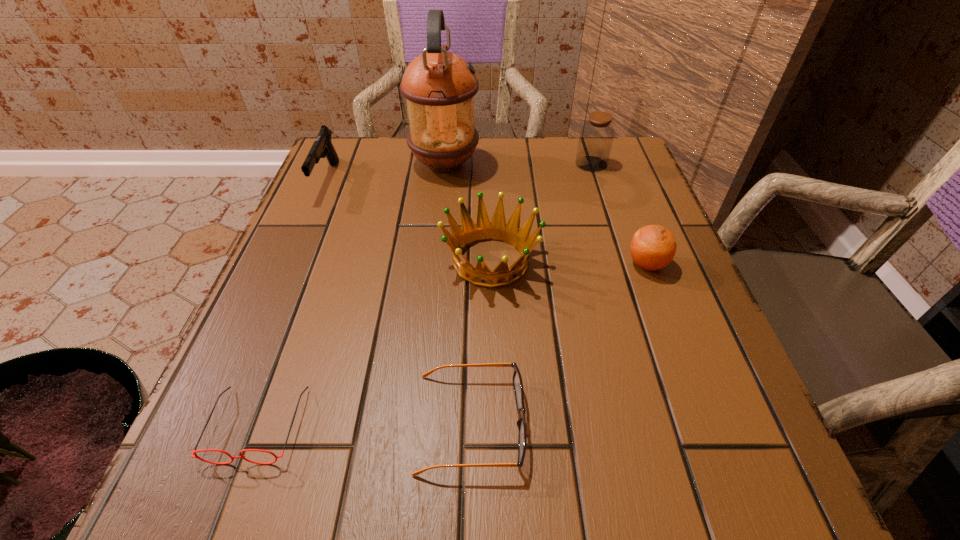
You are a GUI agent. You are given a task and a screenshot of the screen. Output one action in this format:
    pyautogui.click(x=<x>, y=<y>)
    Task: Click on the vacant space that satisfies the following two spatial constraints: 1. on the front side of the orange; 2. on the front-facing side of the right spectacles
    Image resolution: width=960 pixels, height=540 pixels.
    Given the screenshot: What is the action you would take?
    pyautogui.click(x=707, y=423)

Where is `free space that satisfies the following two spatial constraints: 1. at the aiming end of the orange; 2. on the right side of the gun`? The width and height of the screenshot is (960, 540). free space that satisfies the following two spatial constraints: 1. at the aiming end of the orange; 2. on the right side of the gun is located at coordinates (291, 264).